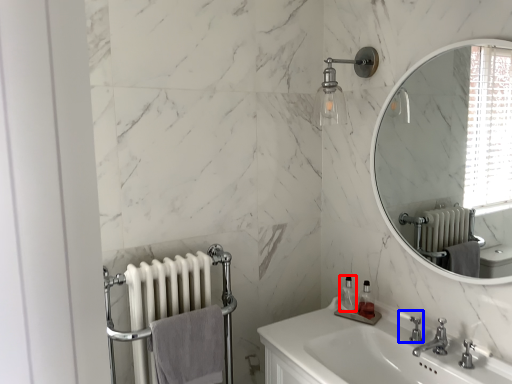
Question: Which object is closer to the camera taking this photo, soap dispenser (highlighted by a red box) or plumbing fixture (highlighted by a blue box)?

Choices:
 (A) soap dispenser
 (B) plumbing fixture

Answer: (B)